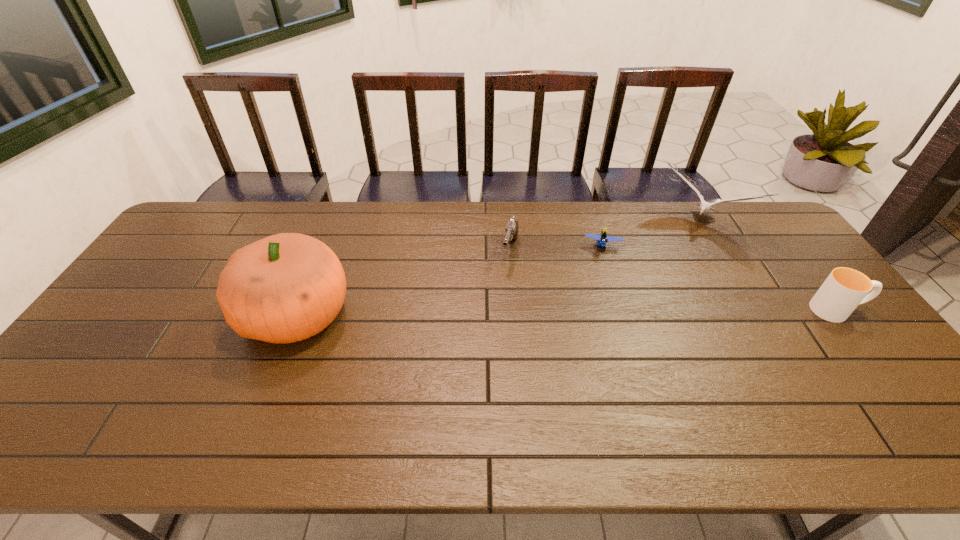
At what (x,y) coordinates should I click in order to perform the action: click on Lego at the far edge. Please return your answer as a coordinate pair (x, y). This screenshot has width=960, height=540. Looking at the image, I should click on point(602,238).

The image size is (960, 540). What are the coordinates of `pistol that is at the far edge` in the screenshot? It's located at (511, 230).

In order to click on gull at the far edge in this screenshot , I will do `click(705, 207)`.

In order to click on cup at the right edge in this screenshot , I will do `click(844, 289)`.

At what (x,y) coordinates should I click in order to perform the action: click on gull that is at the right edge. Please return your answer as a coordinate pair (x, y). Image resolution: width=960 pixels, height=540 pixels. Looking at the image, I should click on (705, 207).

Image resolution: width=960 pixels, height=540 pixels. In order to click on object that is at the far right corner in this screenshot , I will do `click(705, 207)`.

Where is `vacant space at the far edge of the desktop`? This screenshot has width=960, height=540. vacant space at the far edge of the desktop is located at coordinates (568, 233).

In the image, there is a desktop. Identify the location of vacant area at the near edge. Image resolution: width=960 pixels, height=540 pixels. (558, 380).

Find the location of a particular element. This screenshot has height=540, width=960. free space at the left edge is located at coordinates (138, 302).

In the image, there is a desktop. Identify the location of vacant region at the right edge. (828, 367).